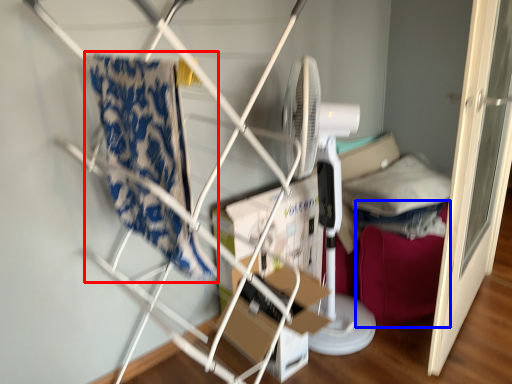
Question: Which of the following is the closest to the observer, beach towel (highlighted by a red box) or bean bag chair (highlighted by a blue box)?

Choices:
 (A) beach towel
 (B) bean bag chair

Answer: (A)